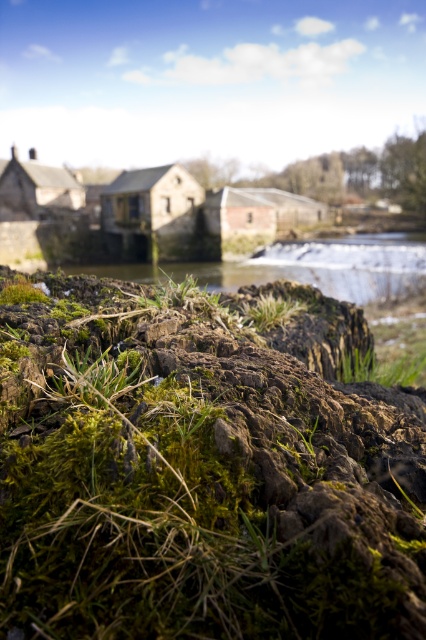
You are standing at the edge of the water in the rural scene. You see a point marked at coordinates (201, 470). What object is located at that point?

The point at coordinates (201, 470) marks the green mossy rock at lower center.